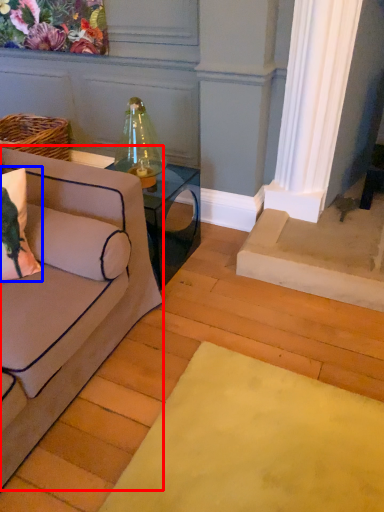
Question: Among these objects, which one is farthest to the camera, studio couch (highlighted by a red box) or pillow (highlighted by a blue box)?

Choices:
 (A) studio couch
 (B) pillow

Answer: (B)